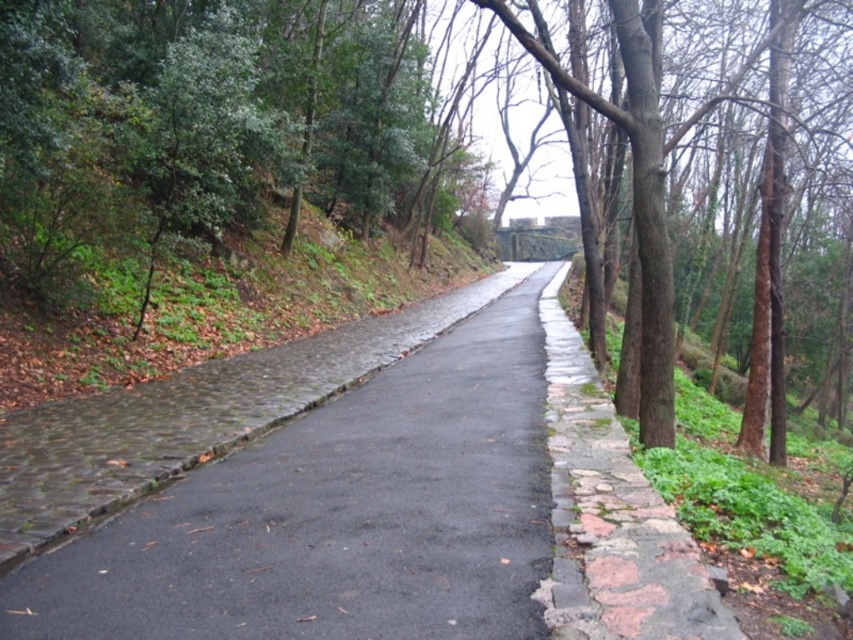
Question: Is brown rough tree at center closer to camera compared to black asphalt road at center?

Choices:
 (A) no
 (B) yes

Answer: (A)

Question: Which point is closer to the camera?

Choices:
 (A) (398, 419)
 (B) (693, 221)

Answer: (A)

Question: Is brown rough tree at center bigger than black asphalt road at center?

Choices:
 (A) yes
 (B) no

Answer: (A)

Question: From the image, what is the correct spatial relationship of brown rough tree at center in relation to black asphalt road at center?

Choices:
 (A) left
 (B) right

Answer: (B)